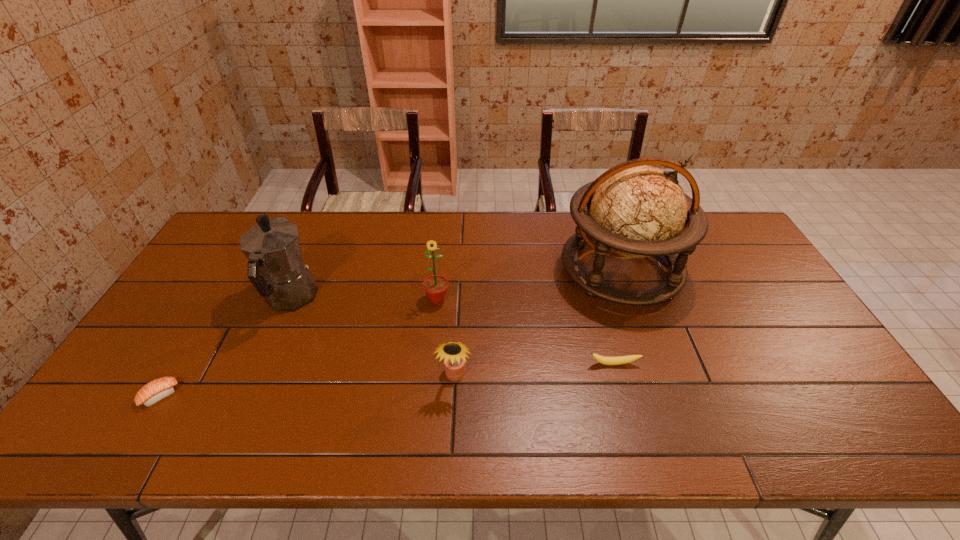
Find the location of a particular element. This screenshot has width=960, height=540. vacant space located on the front of the tallest object is located at coordinates (675, 420).

Identify the location of vacant area situated 0.240m on the pouring side of the coffeepot. (323, 225).

Where is `vacant space located on the pouring side of the coffeepot`? This screenshot has height=540, width=960. vacant space located on the pouring side of the coffeepot is located at coordinates click(x=312, y=248).

What are the coordinates of `free spot located 0.290m on the pouring side of the coffeepot` in the screenshot? It's located at (325, 217).

The image size is (960, 540). Identify the location of vacant space positioned 0.200m on the face of the third tallest object. (430, 365).

Find the location of a particular element. The image size is (960, 540). blank space located 0.150m on the face of the nearer sunflower is located at coordinates (451, 448).

Find the location of a particular element. The image size is (960, 540). free space located on the upward curve of the fifth tallest object is located at coordinates (635, 441).

Locate an element on the screen. vacant space located 0.220m on the right of the leftmost object is located at coordinates coord(266,395).

The width and height of the screenshot is (960, 540). What are the coordinates of `object present at the far edge` in the screenshot? It's located at (633, 210).

The height and width of the screenshot is (540, 960). What are the coordinates of `object that is at the left edge` in the screenshot? It's located at pyautogui.click(x=156, y=390).